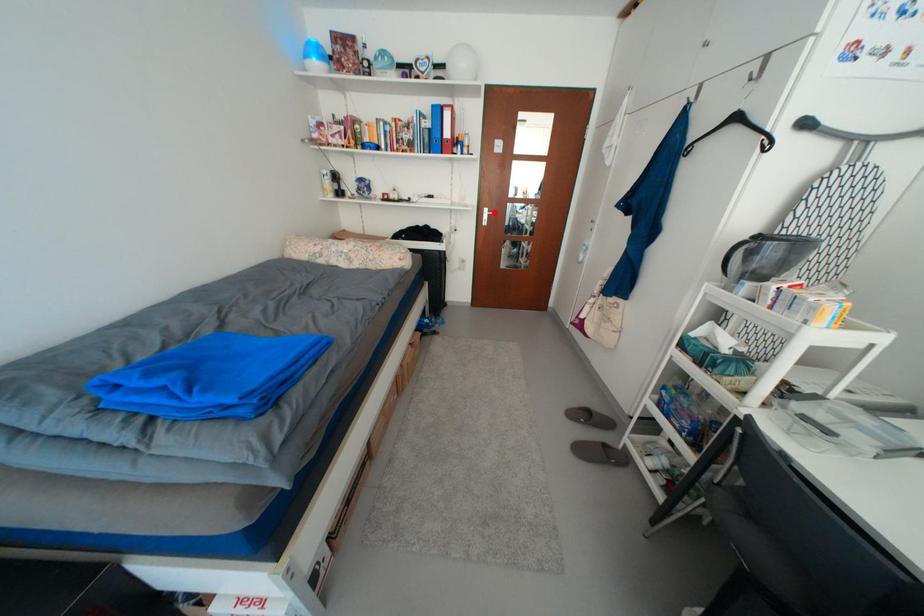
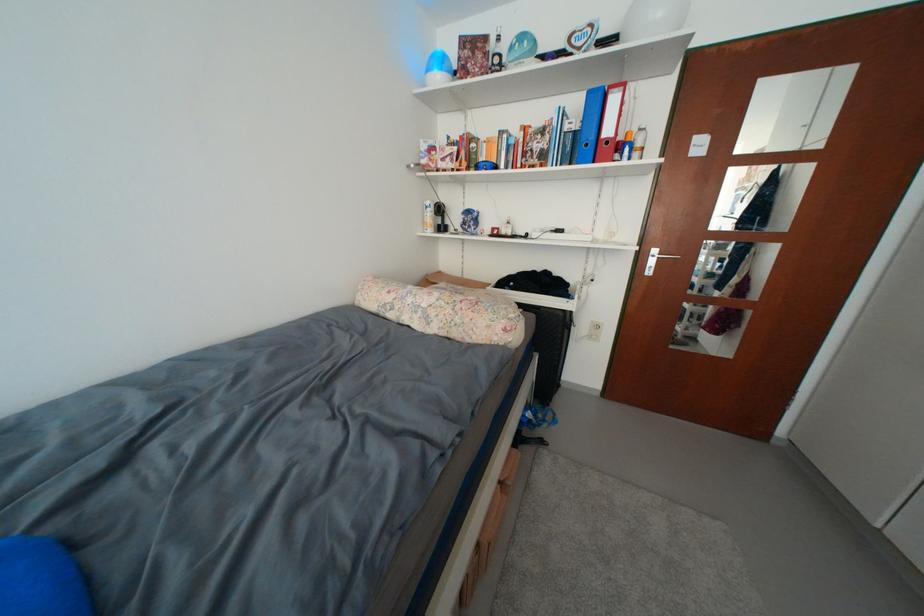
Where in the second image is the point corresponding to the highlighted location from the first image?

(663, 254)